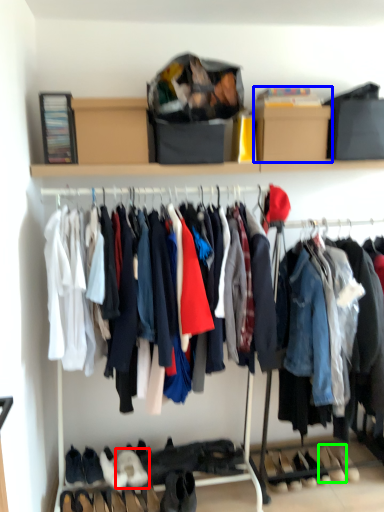
Question: Which object is the farthest from footwear (highlighted by a red box)? Choose among these: cardboard box (highlighted by a blue box) or footwear (highlighted by a green box).

Choices:
 (A) cardboard box
 (B) footwear

Answer: (A)